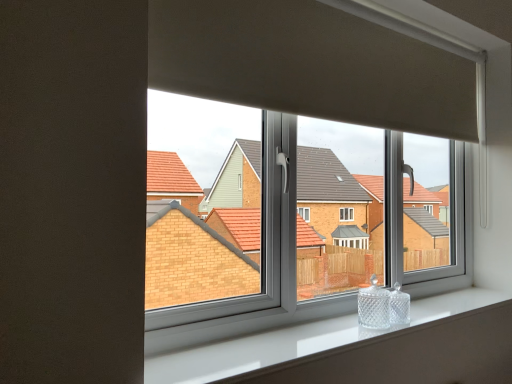
The image size is (512, 384). Describe the element at coordinates (251, 352) in the screenshot. I see `white glossy window sill at lower center` at that location.

The height and width of the screenshot is (384, 512). I want to click on white glossy window sill at lower center, so click(251, 352).

Measure the distance between clear glass window at center and camera.

clear glass window at center is 1.10 meters away from camera.

Where is `clear glass window at center`? clear glass window at center is located at coordinates (316, 95).

Describe the element at coordinates (316, 95) in the screenshot. I see `clear glass window at center` at that location.

Find the location of a particular element. The width and height of the screenshot is (512, 384). white glossy window sill at lower center is located at coordinates (251, 352).

Is clear glass window at center to the left of white glossy window sill at lower center from the viewer's perspective?

Correct, you'll find clear glass window at center to the left of white glossy window sill at lower center.

Which is in front, clear glass window at center or white glossy window sill at lower center?

white glossy window sill at lower center is more forward.

Does point (442, 70) come closer to viewer compared to point (247, 343)?

No, it is behind (247, 343).

From the image's perspective, is clear glass window at center beneath white glossy window sill at lower center?

No, from the image's perspective, clear glass window at center is not beneath white glossy window sill at lower center.

From a real-world perspective, relative to white glossy window sill at lower center, is clear glass window at center vertically above or below?

Clearly, from a real-world perspective, clear glass window at center is above white glossy window sill at lower center.

Does clear glass window at center have a greater width compared to white glossy window sill at lower center?

In fact, clear glass window at center might be narrower than white glossy window sill at lower center.

Is clear glass window at center taller than white glossy window sill at lower center?

Yes.

In terms of size, does clear glass window at center appear bigger or smaller than white glossy window sill at lower center?

Clearly, clear glass window at center is larger in size than white glossy window sill at lower center.

Would you say white glossy window sill at lower center is part of clear glass window at center's contents?

No, white glossy window sill at lower center is not surrounded by clear glass window at center.

Is the surface of clear glass window at center in direct contact with white glossy window sill at lower center?

No, clear glass window at center is not touching white glossy window sill at lower center.

Is clear glass window at center facing away from white glossy window sill at lower center?

No, clear glass window at center is not facing away from white glossy window sill at lower center.

You are a GUI agent. You are given a task and a screenshot of the screen. Output one action in this format:
    pyautogui.click(x=<x>, y=<y>)
    Task: Click on the window above the white glossy window sill at lower center (from the image's perspective)
    This screenshot has width=512, height=384.
    Given the screenshot: What is the action you would take?
    pyautogui.click(x=316, y=95)

Based on the photo, visually, is white glossy window sill at lower center positioned to the left or to the right of clear glass window at center?

In the image, white glossy window sill at lower center appears on the right side of clear glass window at center.

Is white glossy window sill at lower center positioned in front of clear glass window at center?

Yes.

Does point (211, 370) come in front of point (308, 67)?

Yes, it is.

From the image's perspective, is white glossy window sill at lower center beneath clear glass window at center?

Yes.

From a real-world perspective, between white glossy window sill at lower center and clear glass window at center, who is vertically higher?

clear glass window at center is physically above.

Which object is wider, white glossy window sill at lower center or clear glass window at center?

white glossy window sill at lower center is wider.

Between white glossy window sill at lower center and clear glass window at center, which one has less height?

Standing shorter between the two is white glossy window sill at lower center.

Considering the relative sizes of white glossy window sill at lower center and clear glass window at center in the image provided, is white glossy window sill at lower center bigger than clear glass window at center?

Incorrect, white glossy window sill at lower center is not larger than clear glass window at center.

Is white glossy window sill at lower center inside or outside of clear glass window at center?

white glossy window sill at lower center is not inside clear glass window at center, it's outside.

Is white glossy window sill at lower center not close to clear glass window at center?

No, white glossy window sill at lower center is not far away from clear glass window at center.

Does white glossy window sill at lower center turn towards clear glass window at center?

No, white glossy window sill at lower center is not turned towards clear glass window at center.

What's the angular difference between white glossy window sill at lower center and clear glass window at center's facing directions?

0.844 degrees.

Locate an element on the screen. This screenshot has height=384, width=512. window sill lying on the right of clear glass window at center is located at coordinates (251, 352).

Find the location of a particular element. The width and height of the screenshot is (512, 384). window behind the white glossy window sill at lower center is located at coordinates (316, 95).

I want to click on window sill located underneath the clear glass window at center (from a real-world perspective), so click(251, 352).